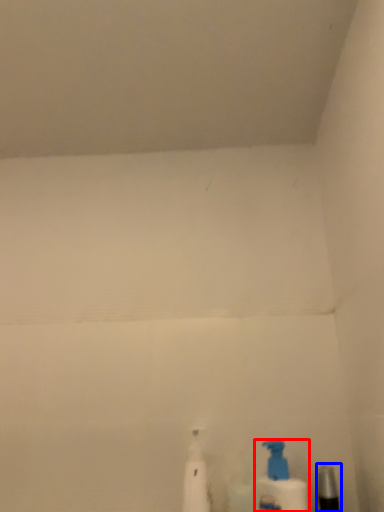
Question: Which object appears farthest to the camera in this image, bottle (highlighted by a red box) or toiletry (highlighted by a blue box)?

Choices:
 (A) bottle
 (B) toiletry

Answer: (A)